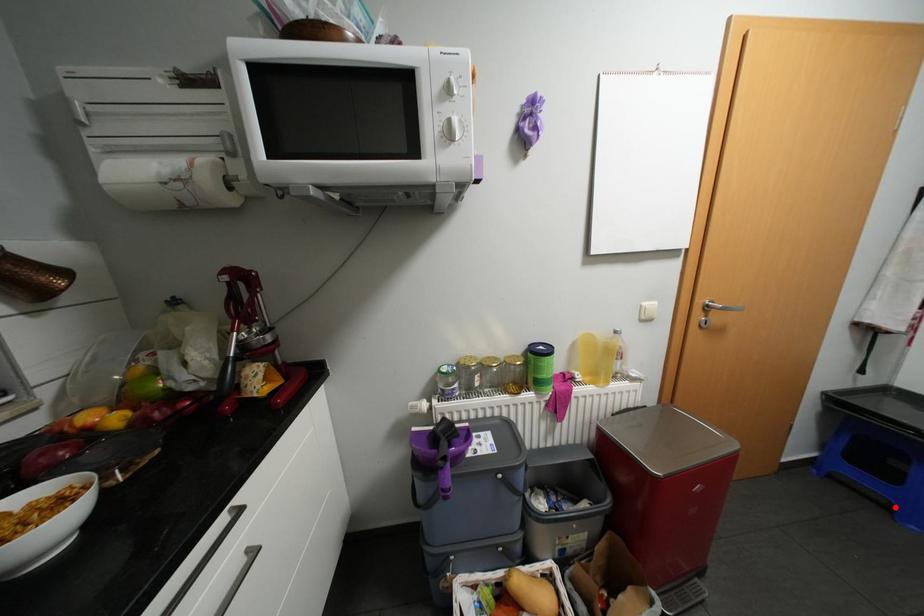
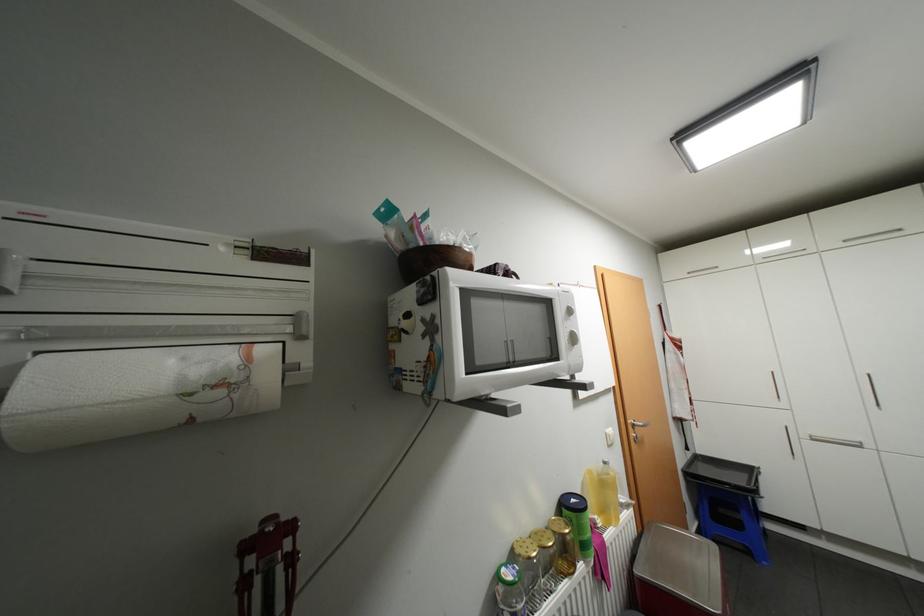
The point at the highlighted location is marked in the first image. Where is the corresponding point in the second image?

(756, 552)